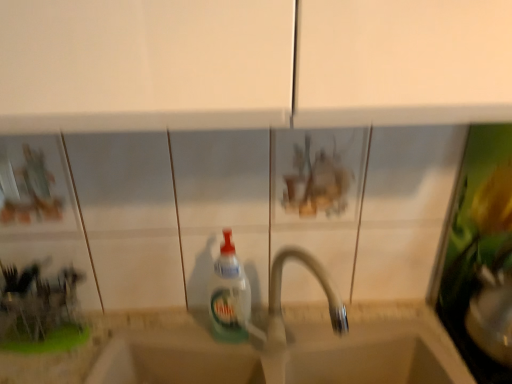
You are a GUI agent. You are given a task and a screenshot of the screen. Output one action in this format:
    pyautogui.click(x=<x>, y=<y>)
    Task: Click on the vacant area situated to the left side of translucent plastic bottle at center
    The width and height of the screenshot is (512, 384).
    Given the screenshot: What is the action you would take?
    pyautogui.click(x=168, y=332)